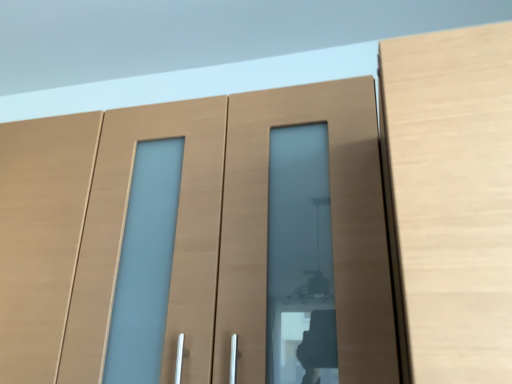
Locate an element on the screen. matte wood door at center is located at coordinates (241, 239).

Image resolution: width=512 pixels, height=384 pixels. What do you see at coordinates (241, 239) in the screenshot?
I see `matte wood door at center` at bounding box center [241, 239].

This screenshot has height=384, width=512. What are the coordinates of `matte wood door at center` in the screenshot? It's located at (241, 239).